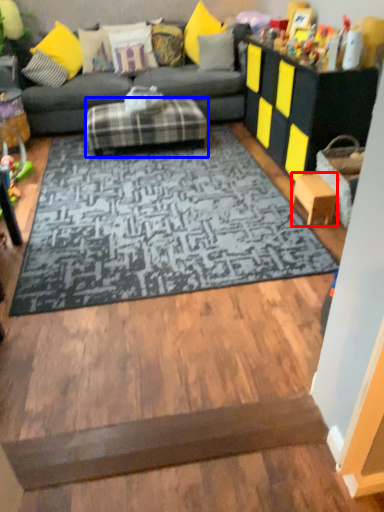
Question: Which of the following is the farthest to the observer, stool (highlighted by a red box) or footrest (highlighted by a blue box)?

Choices:
 (A) stool
 (B) footrest

Answer: (B)